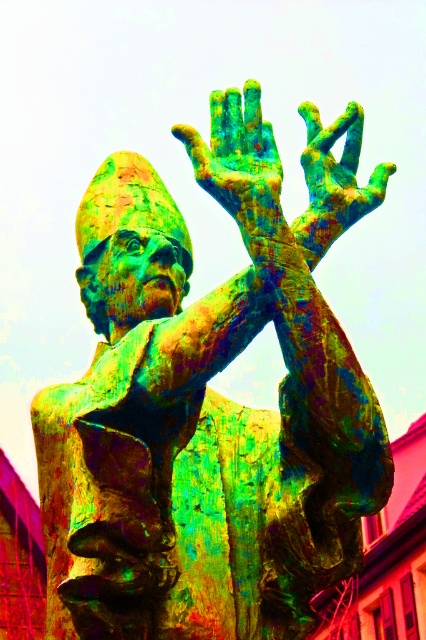
Question: Which of the following is the closest to the observer?

Choices:
 (A) (213, 150)
 (B) (333, 182)

Answer: (A)

Question: Is bronze textured hand at upper center positioned in front of green painted hand at upper center?

Choices:
 (A) yes
 (B) no

Answer: (A)

Question: Which object is farther from the camera taking this photo?

Choices:
 (A) green painted hand at upper center
 (B) bronze textured hand at upper center

Answer: (A)

Question: In this image, where is bronze textured hand at upper center located relative to green painted hand at upper center?

Choices:
 (A) above
 (B) below

Answer: (B)

Question: Does bronze textured hand at upper center appear under green painted hand at upper center?

Choices:
 (A) yes
 (B) no

Answer: (A)